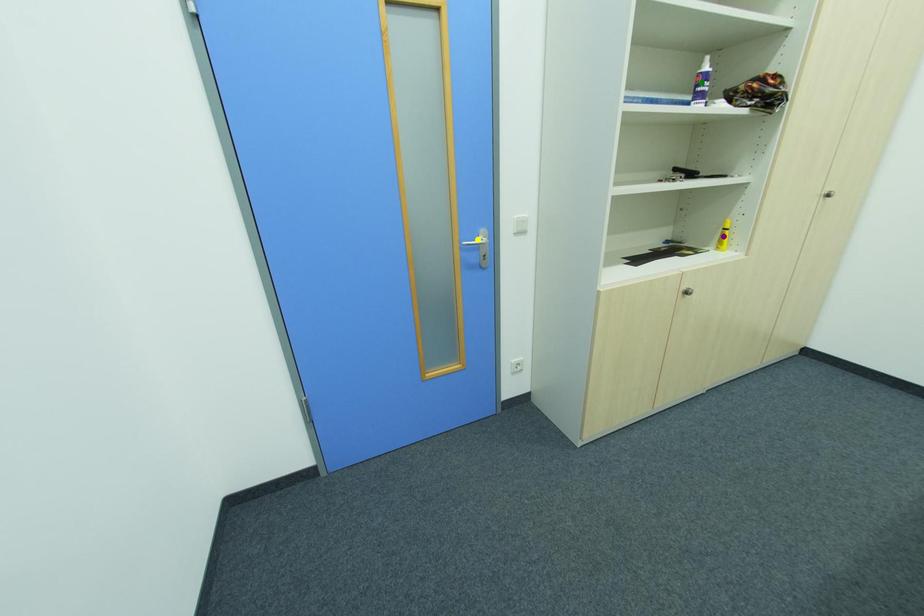
Order these from nearest to farthest:
A) purple point
B) green point
C) yellow point

green point < yellow point < purple point